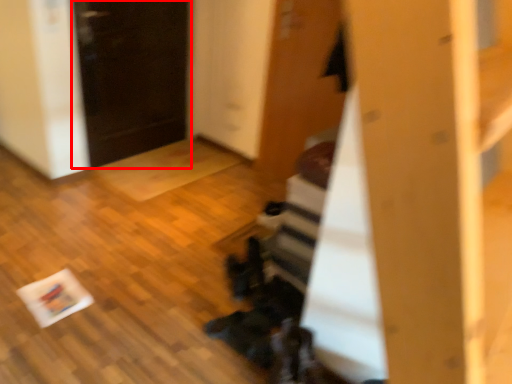
Question: From the image's perspective, what is the correct spatial positioning of door (annotated by the red box) in reference to door?

Choices:
 (A) below
 (B) above

Answer: (B)